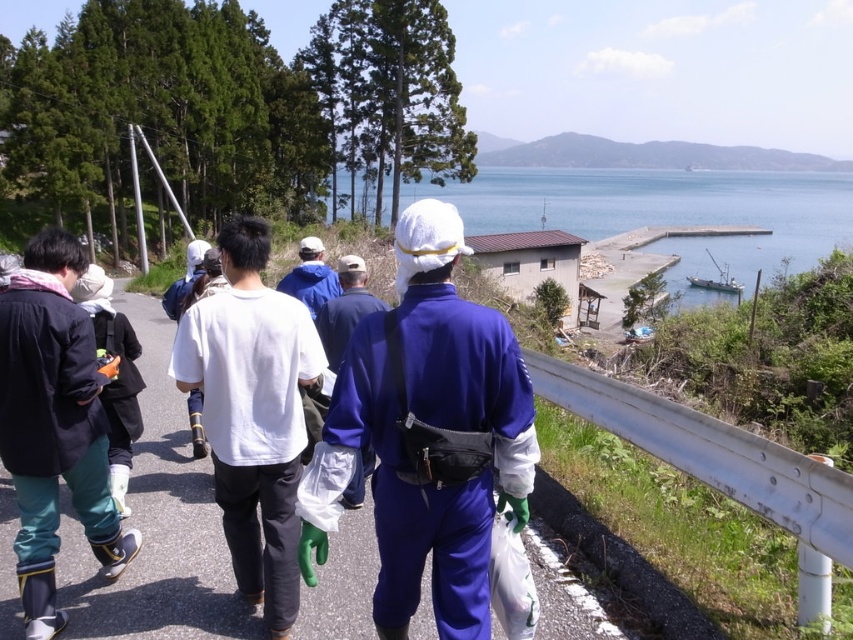
You are standing at the point with coordinates (345,308). Looking around, you see a blue fabric bag at center. Which direction should you face to see the small building with a red tiled roof situated close to the water edge?

The blue fabric bag at center is located at point (345,308). Since the small building with a red tiled roof is situated close to the water edge beyond the embankment, you should face towards the direction of the water to see it.

You are a photographer standing at the scene. You want to take a photo of the blue fabric bag at center without including the guardrail in the background. Based on the distance provided, can you estimate if you can step back enough to exclude the guardrail?

The blue fabric bag at center is 11.04 feet away from the camera. Since the guardrail is behind the bag, stepping back would allow you to frame the shot so that the guardrail is no longer in the background. However, the exact feasibility depends on the camera lens and field of view, but given the distance, it should be possible to position yourself appropriately to exclude the guardrail.

You are a photographer trying to capture a shot of the white fabric shirt at center and the blue water at center. Based on their sizes in the image, which object would you focus on first to ensure it is in sharp focus?

The white fabric shirt at center occupies less space than blue water at center, so you should focus on the blue water at center first since it takes up more of the frame and will be easier to focus on.